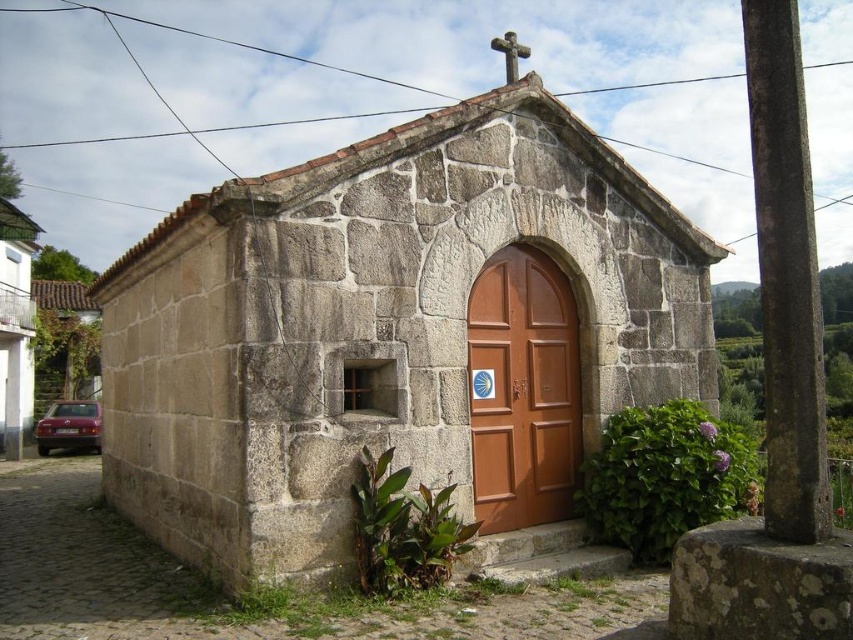
Does point (795, 204) come farther from viewer compared to point (22, 426)?

No, it is not.

From the picture: Does smooth concrete pillar at right appear under white stone church at left?

Incorrect, smooth concrete pillar at right is not positioned below white stone church at left.

Which is in front, point (801, 378) or point (16, 280)?

Point (801, 378) is more forward.

In order to click on smooth concrete pillar at right in this screenshot , I will do `click(786, 275)`.

Does stone church at center lie in front of brown wooden door at center?

Yes, stone church at center is closer to the viewer.

Does point (515, 394) come farther from viewer compared to point (521, 442)?

Yes, point (515, 394) is farther from viewer.

Identify the location of stone church at center. This screenshot has height=640, width=853. (393, 333).

Where is `stone church at center`? This screenshot has width=853, height=640. stone church at center is located at coordinates (393, 333).

Which of these two, brown wooden door at center or white stone church at left, stands shorter?

brown wooden door at center is shorter.

Can you confirm if brown wooden door at center is thinner than white stone church at left?

Indeed, brown wooden door at center has a lesser width compared to white stone church at left.

Is point (573, 308) farther from viewer compared to point (15, 266)?

No, it is not.

This screenshot has width=853, height=640. I want to click on brown wooden door at center, so click(x=521, y=390).